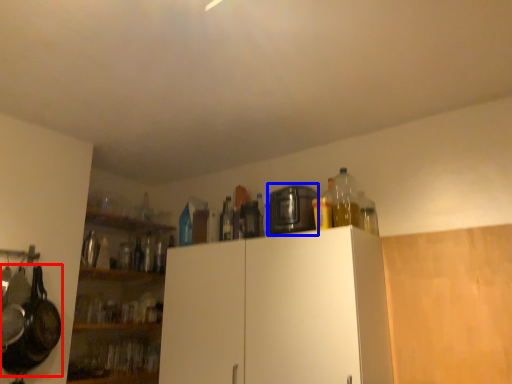
Question: Which point is further to the camera, frying pan (highlighted by a red box) or appliance (highlighted by a blue box)?

Choices:
 (A) frying pan
 (B) appliance

Answer: (B)